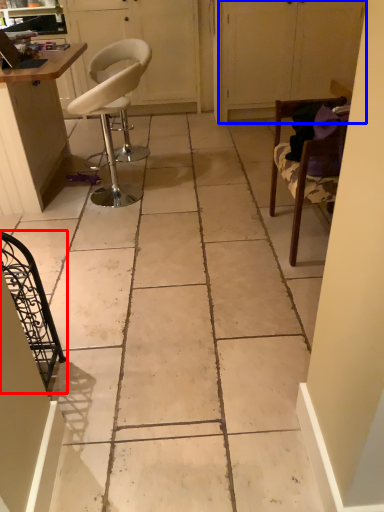
Question: Which of the following is the farthest to the observer, chair (highlighted by a red box) or screen door (highlighted by a blue box)?

Choices:
 (A) chair
 (B) screen door

Answer: (B)